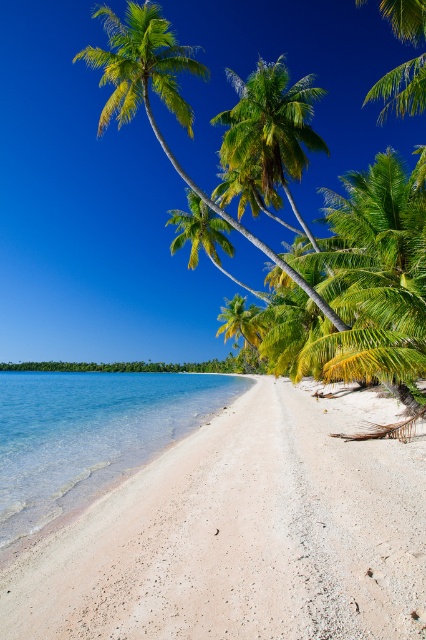
Is clear water at lower left above green leafy palm tree at center?

Incorrect, clear water at lower left is not positioned above green leafy palm tree at center.

Is point (85, 497) more distant than point (262, 150)?

No, it is in front of (262, 150).

The height and width of the screenshot is (640, 426). I want to click on clear water at lower left, so click(89, 433).

Is white sandy beach at center taller than green leafy palm tree at upper left?

No, white sandy beach at center is not taller than green leafy palm tree at upper left.

Between white sandy beach at center and green leafy palm tree at upper left, which one has more height?

green leafy palm tree at upper left

Identify the location of white sandy beach at center. The height and width of the screenshot is (640, 426). (241, 534).

This screenshot has width=426, height=640. I want to click on white sandy beach at center, so click(241, 534).

Measure the distance between point (187, 109) and camera.

A distance of 14.51 meters exists between point (187, 109) and camera.

Based on the photo, who is positioned more to the right, green leafy palm tree at upper left or green leafy palm tree at center?

Positioned to the right is green leafy palm tree at center.

Image resolution: width=426 pixels, height=640 pixels. Describe the element at coordinates (164, 99) in the screenshot. I see `green leafy palm tree at upper left` at that location.

Locate an element on the screen. The image size is (426, 640). green leafy palm tree at upper left is located at coordinates (164, 99).